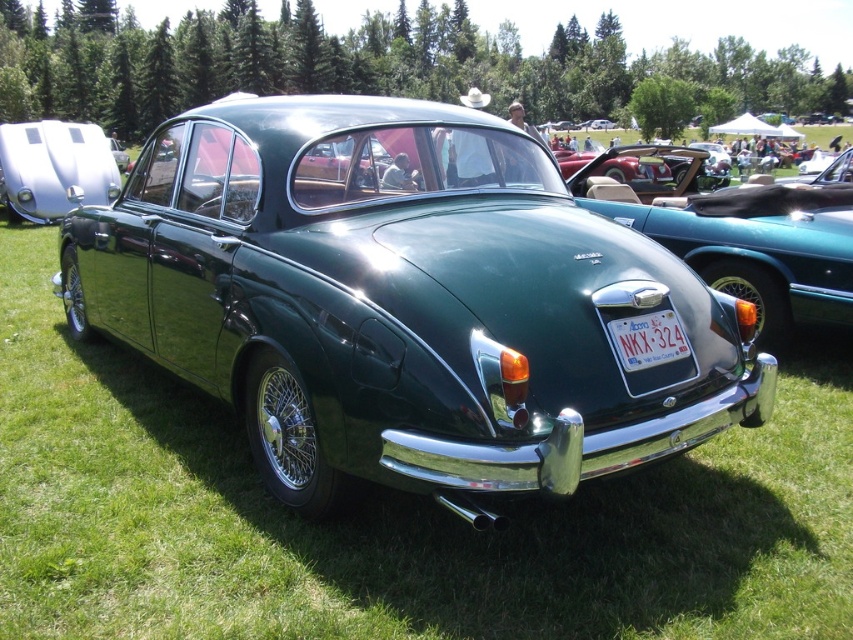
You are standing 50 feet away from the shiny white car at left. Can you safely walk towards it without getting too close?

The distance between you and the shiny white car at left is 44.51 feet, which is less than 50 feet. Therefore, you are already closer than 50 feet, so you should not walk any closer to avoid getting too near.

You are a photographer at a car show and want to take a photo of the shiny white car at left and the white plastic license plate at center. Which object is located to the left of the other?

The shiny white car at left is positioned on the left side of the white plastic license plate at center.